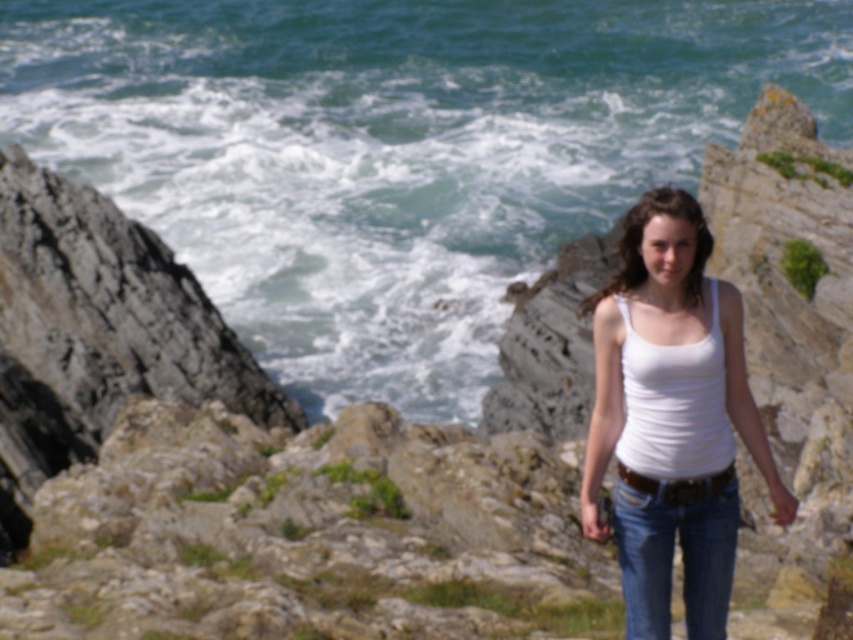
You are a photographer planning to take a photo of the coastal scene. You want to ensure that both the point at (776, 4) and the point at (693, 522) are visible in the frame. Based on their positions, which point is closer to the camera?

Point (693, 522) is closer to the camera because it is in front of point (776, 4), which is behind it.

You are a fashion designer analyzing the outfit of the person in the coastal scene. Based on the image, which clothing item is wider between the white cotton tank top at center and the blue denim jeans at center?

The white cotton tank top at center is wider than the blue denim jeans at center, as stated in the description.

You are a photographer trying to capture a wide shot of the scene. You need to ensure that both the blue water at center and the blue denim jeans at center are clearly visible in the frame. Given their relative sizes, which object should you prioritize positioning closer to the camera to maintain clarity and detail?

The blue denim jeans at center should be positioned closer to the camera since it is smaller in width compared to the blue water at center. This ensures that both objects remain clearly visible and detailed in the photograph.